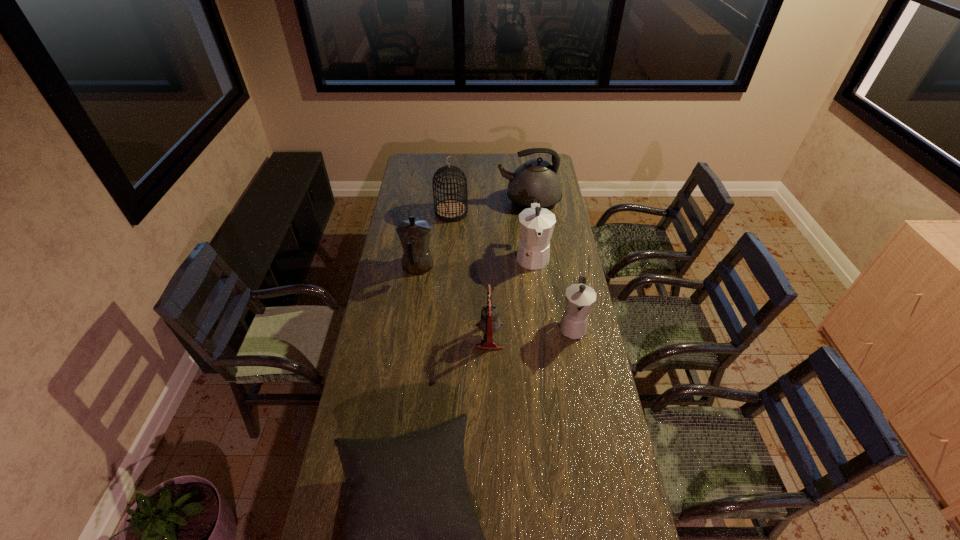
You are a GUI agent. You are given a task and a screenshot of the screen. Output one action in this format:
    pyautogui.click(x=<x>, y=<y>)
    Task: Click on the free space located on the pouring side of the leftmost coffeepot
    
    Given the screenshot: What is the action you would take?
    pyautogui.click(x=422, y=234)

At what (x,y) coordinates should I click in order to perform the action: click on free region located 0.200m on the pouring side of the leftmost coffeepot. Please return your answer as a coordinate pair (x, y). The height and width of the screenshot is (540, 960). Looking at the image, I should click on (423, 224).

Find the location of a particular element. This screenshot has width=960, height=540. free space located on the left of the nearest coffeepot is located at coordinates (540, 327).

The image size is (960, 540). In order to click on vacant point located 0.170m on the right of the bell in this screenshot , I will do `click(545, 336)`.

Find the location of `object that is at the left edge`. object that is at the left edge is located at coordinates (414, 234).

This screenshot has width=960, height=540. In order to click on kettle at the right edge in this screenshot , I will do `click(537, 179)`.

Find the location of a particular element. This screenshot has width=960, height=540. vacant point at the far edge is located at coordinates (433, 169).

Where is `vacant area at the left edge of the desktop`? This screenshot has height=540, width=960. vacant area at the left edge of the desktop is located at coordinates (348, 507).

Where is `free spot at the right edge of the desktop`? free spot at the right edge of the desktop is located at coordinates (577, 501).

Where is `free space between the bell and the kettle`? The width and height of the screenshot is (960, 540). free space between the bell and the kettle is located at coordinates (509, 268).